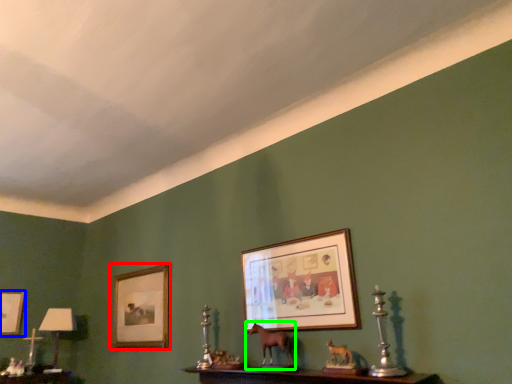
Question: Which is farther away from picture frame (highlighted by a red box)? picture frame (highlighted by a blue box) or animal (highlighted by a green box)?

Choices:
 (A) picture frame
 (B) animal

Answer: (B)